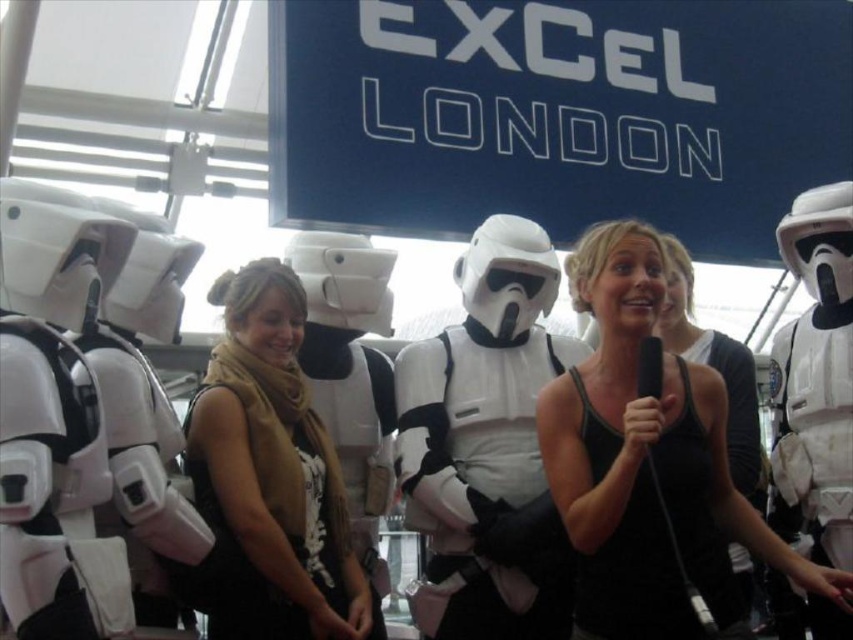
Question: Can you confirm if white matte stormtrooper armor at center is smaller than black matte tank top at center?

Choices:
 (A) yes
 (B) no

Answer: (B)

Question: Which object is positioned closest to the white matte stormtrooper armor at center?

Choices:
 (A) black matte tank top at center
 (B) tan scarf at center

Answer: (A)

Question: Does black tank top at center appear under tan scarf at center?

Choices:
 (A) yes
 (B) no

Answer: (B)

Question: Which point appears farthest from the camera in this image?

Choices:
 (A) (560, 584)
 (B) (613, 353)
 (C) (334, 545)
 (D) (595, 483)

Answer: (B)

Question: Based on their relative distances, which object is farther from the black tank top at center?

Choices:
 (A) tan scarf at center
 (B) white matte stormtrooper armor at center
 (C) black matte tank top at center

Answer: (A)

Question: Is tan scarf at center below white matte stormtrooper armor at center?

Choices:
 (A) yes
 (B) no

Answer: (B)